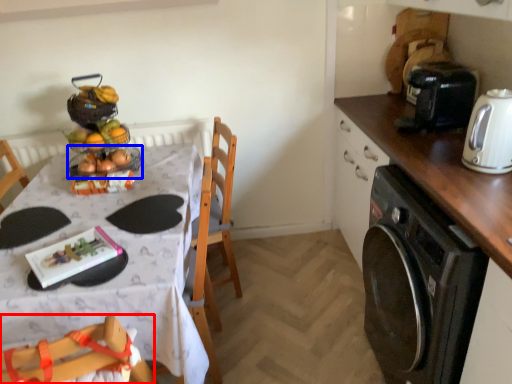
Question: Which of the following is the farthest to the observer, chair (highlighted by a red box) or basket (highlighted by a blue box)?

Choices:
 (A) chair
 (B) basket

Answer: (B)